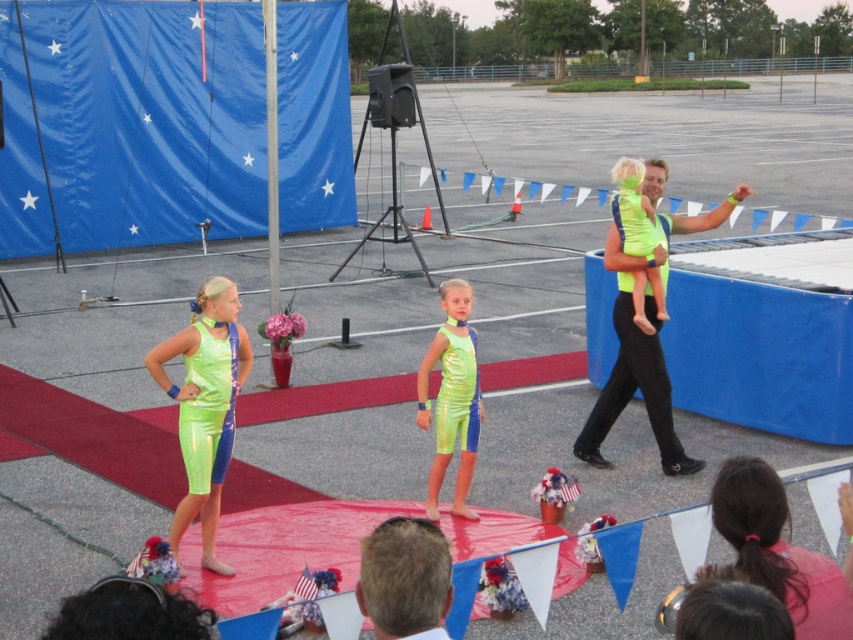
You are a photographer at the back of the stage. You need to capture a clear photo of both the neon green spandex at center and the shiny metallic dress at center. Which one will appear bigger in your photo?

The neon green spandex at center will appear bigger in the photo because it is larger in size than the shiny metallic dress at center.

You are a photographer setting up for a group photo. You notice the neon green fabric at right and the shiny metallic dress at center. Which object should you focus on first if you want to capture both in the same frame without moving the camera?

The neon green fabric at right is above the shiny metallic dress at center, so focusing on the neon green fabric at right first will ensure both are in the frame as the dress is below it.